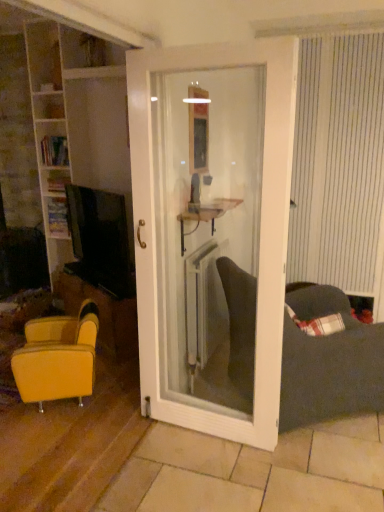
Image resolution: width=384 pixels, height=512 pixels. Find the location of `vacant space to the right of white wooden door at center`. vacant space to the right of white wooden door at center is located at coordinates (317, 463).